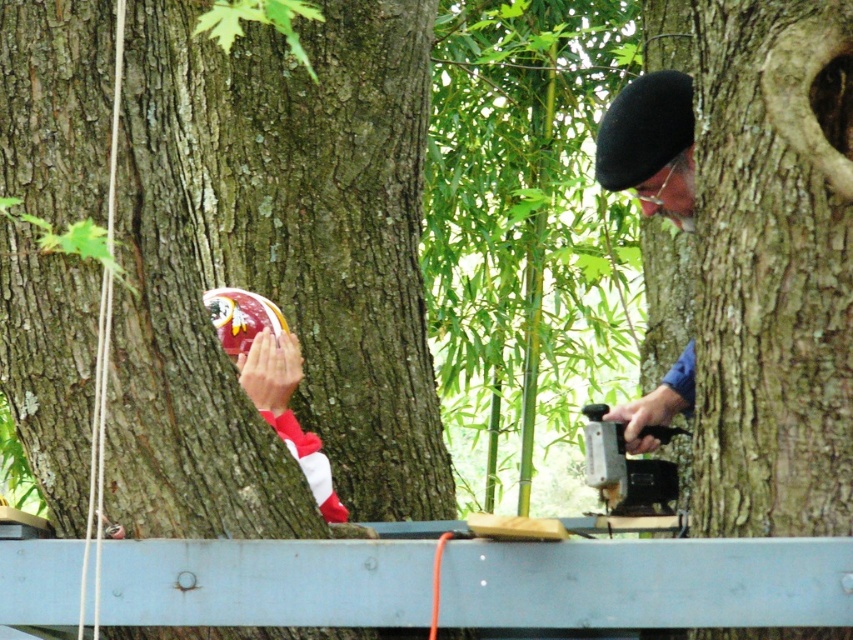
Is smooth gray plank at center bigger than metallic gray stapler at right?

No, smooth gray plank at center is not bigger than metallic gray stapler at right.

Is point (822, 624) in front of point (611, 477)?

Yes, point (822, 624) is in front of point (611, 477).

The height and width of the screenshot is (640, 853). I want to click on smooth gray plank at center, so pyautogui.click(x=648, y=582).

Does brown rough bark at center have a larger size compared to matte black beret at upper right?

Yes.

Measure the distance between brown rough bark at center and matte black beret at upper right.

brown rough bark at center and matte black beret at upper right are 72.24 centimeters apart from each other.

Where is `brown rough bark at center`? brown rough bark at center is located at coordinates (274, 272).

At what (x,y) coordinates should I click in order to perform the action: click on brown rough bark at center. Please return your answer as a coordinate pair (x, y). Image resolution: width=853 pixels, height=640 pixels. Looking at the image, I should click on (274, 272).

Is rough bark tree at center positioned before smooth gray plank at center?

No.

Which is more to the right, rough bark tree at center or smooth gray plank at center?

rough bark tree at center is more to the right.

Who is more forward, (x=775, y=326) or (x=155, y=570)?

Point (x=155, y=570) is in front.

Locate an element on the screen. Image resolution: width=853 pixels, height=640 pixels. rough bark tree at center is located at coordinates (773, 268).